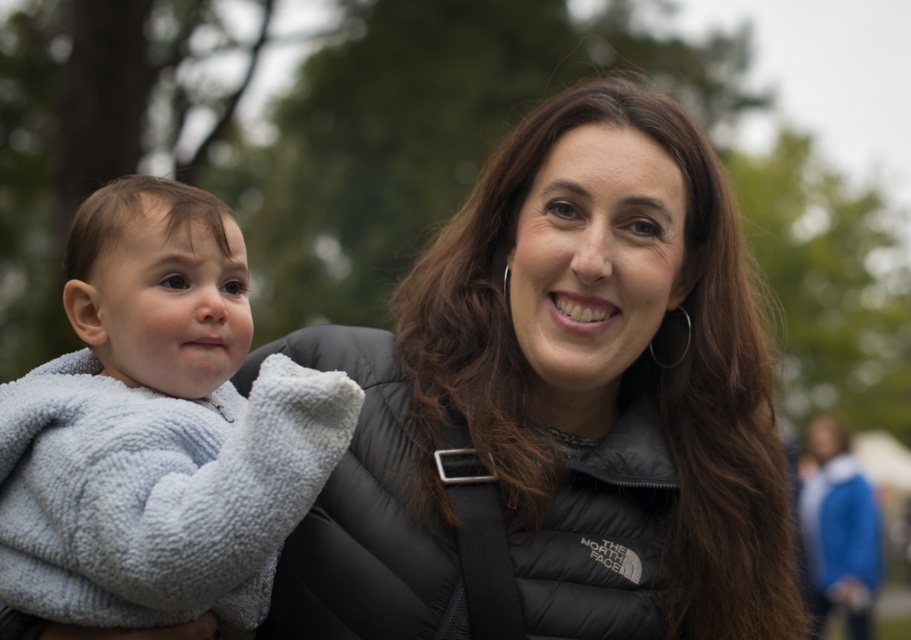
Does black puffer jacket at center have a greater height compared to soft gray fleece at left?

Yes, black puffer jacket at center is taller than soft gray fleece at left.

Does point (751, 381) come behind point (100, 598)?

Yes.

Locate an element on the screen. black puffer jacket at center is located at coordinates (561, 401).